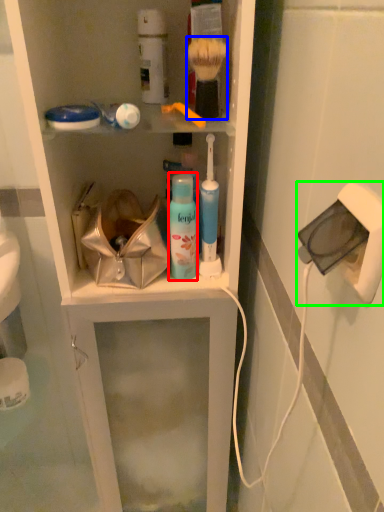
Question: Based on their relative distances, which object is nearer to mouthwash (highlighted by a red box)? Choose from brush (highlighted by a blue box) and electric outlet (highlighted by a green box).

Choices:
 (A) brush
 (B) electric outlet

Answer: (A)